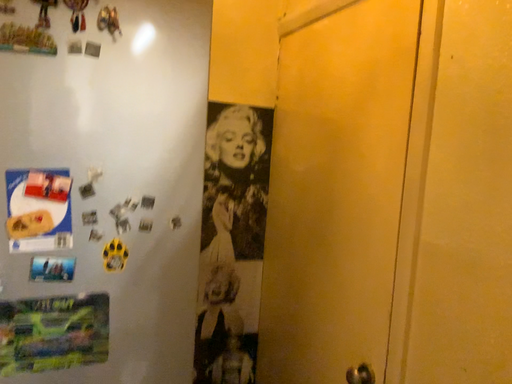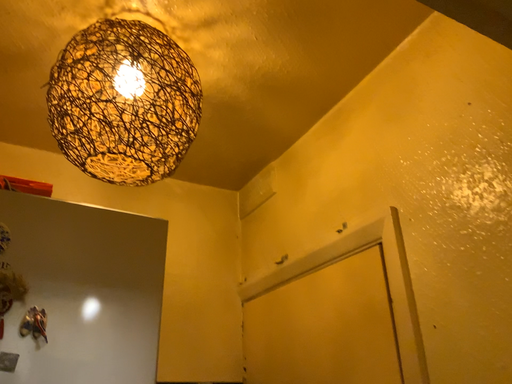
Question: How did the camera likely rotate when shooting the video?

Choices:
 (A) rotated upward
 (B) rotated downward

Answer: (A)